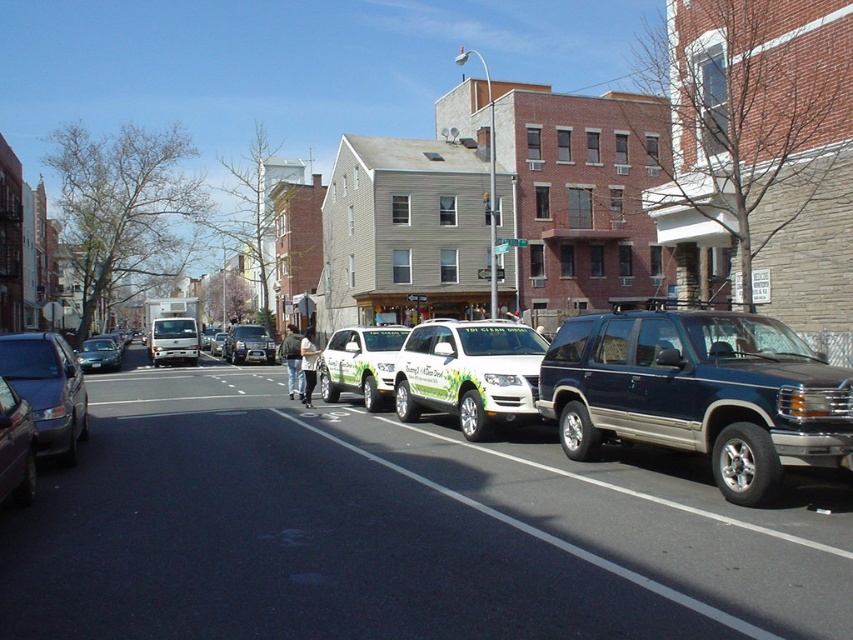
You are a delivery driver who needs to park your vehicle between the green matte suv at center and the green matte van at center. Your vehicle is 5 meters long. Is there enough space between them to park your vehicle?

The distance between the green matte suv at center and the green matte van at center is 15.92 meters. Since your vehicle is 5 meters long, there is sufficient space to park between them.

From the picture: You are a delivery driver who needs to park your truck between the green and white suv at center and the white glossy van at center. Your truck is 2 meters tall. Can you fit your truck in that space?

The green and white suv at center is taller than the white glossy van at center. Since the suv is taller, the space between them might be constrained by the suv height. However, the van is shorter. If the parking space height is determined by the lower of the two, the van, then 2 meters may be okay. But if the space is limited by the suv, it might be too tall. Need more info on the actual height of the suv and van.